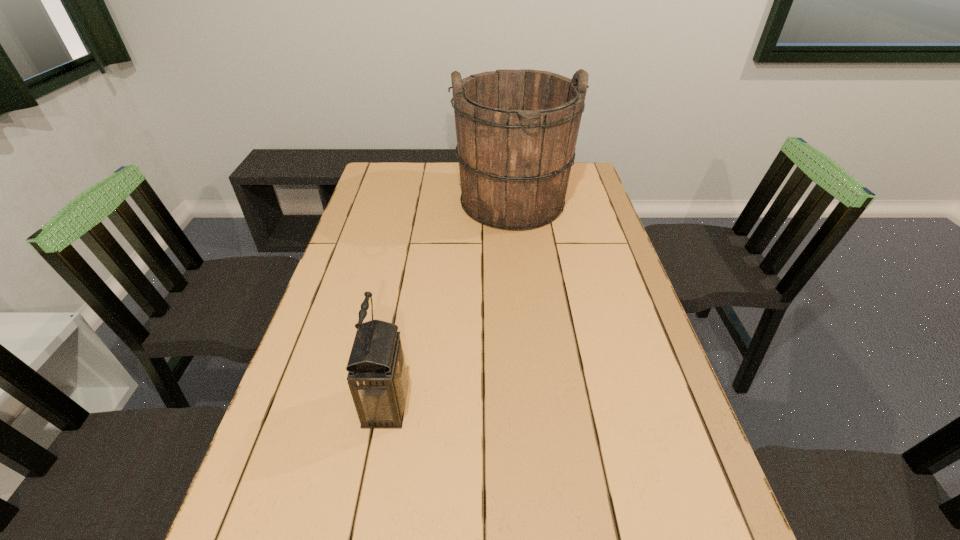
Locate an element on the screen. bucket is located at coordinates (516, 130).

You are a GUI agent. You are given a task and a screenshot of the screen. Output one action in this format:
    pyautogui.click(x=<x>, y=<y>)
    Task: Click on the farther object
    
    Given the screenshot: What is the action you would take?
    pyautogui.click(x=516, y=130)

Image resolution: width=960 pixels, height=540 pixels. In order to click on the shorter object in this screenshot , I will do `click(377, 377)`.

Where is `the nearer object`? Image resolution: width=960 pixels, height=540 pixels. the nearer object is located at coordinates (377, 377).

The width and height of the screenshot is (960, 540). Identify the location of vacant space located 0.220m on the front of the right object. (521, 289).

You are a GUI agent. You are given a task and a screenshot of the screen. Output one action in this format:
    pyautogui.click(x=<x>, y=<y>)
    Task: Click on the vacant area located 0.260m on the front-facing side of the nearer object
    The width and height of the screenshot is (960, 540).
    Given the screenshot: What is the action you would take?
    pyautogui.click(x=529, y=404)

What are the coordinates of `object positioned at the far edge` in the screenshot? It's located at (516, 130).

Locate an element on the screen. object positioned at the right edge is located at coordinates (516, 130).

Identify the location of object located at the far right corner. This screenshot has height=540, width=960. (516, 130).

Where is `free space at the far edge of the desktop`? free space at the far edge of the desktop is located at coordinates (445, 164).